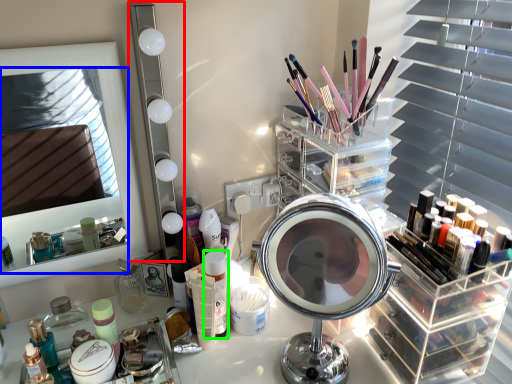
Question: Which object is the farthest from mirror (highlighted by a red box)? Choose among these: mirror (highlighted by a blue box) or toiletry (highlighted by a green box).

Choices:
 (A) mirror
 (B) toiletry

Answer: (A)